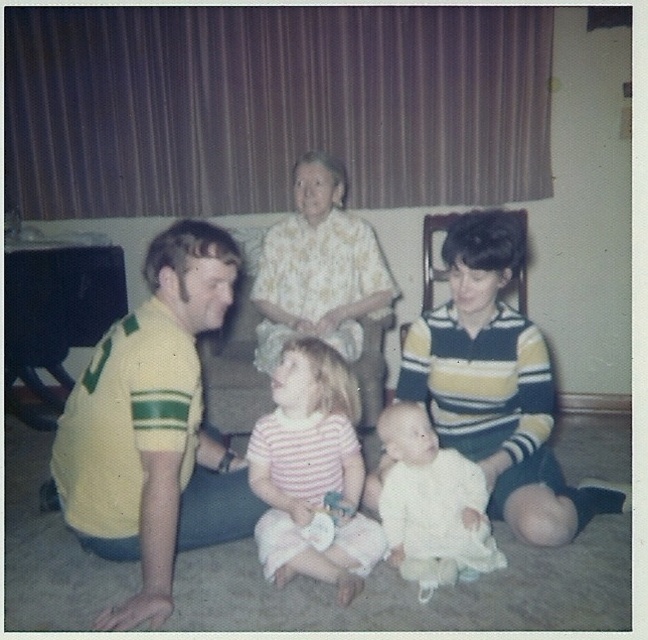
Can you confirm if pink striped shirt at center is positioned above white soft baby at center?

Indeed, pink striped shirt at center is positioned over white soft baby at center.

Is pink striped shirt at center thinner than white soft baby at center?

No.

Does point (345, 564) lie in front of point (421, 442)?

Yes, point (345, 564) is closer to viewer.

Find the location of a particular element. pink striped shirt at center is located at coordinates click(x=310, y=470).

Between yellow jersey at left and yellow striped polo shirt at left, which one appears on the right side from the viewer's perspective?

yellow striped polo shirt at left

Measure the distance between yellow jersey at left and yellow striped polo shirt at left.

They are 24.06 inches apart.

The height and width of the screenshot is (640, 648). What are the coordinates of `yellow jersey at left` in the screenshot? It's located at (154, 428).

Looking at this image, does yellow jersey at left have a smaller size compared to pink striped shirt at center?

No, yellow jersey at left is not smaller than pink striped shirt at center.

Is point (163, 490) positioned before point (290, 378)?

That is True.

Locate an element on the screen. yellow jersey at left is located at coordinates (154, 428).

Find the location of a particular element. The width and height of the screenshot is (648, 640). yellow jersey at left is located at coordinates (154, 428).